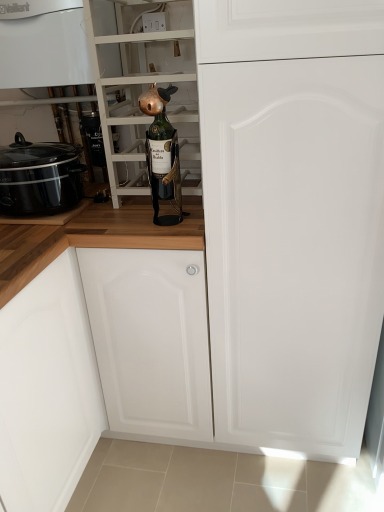
In order to click on free space to the back side of green glass bottle at center in this screenshot , I will do `click(160, 207)`.